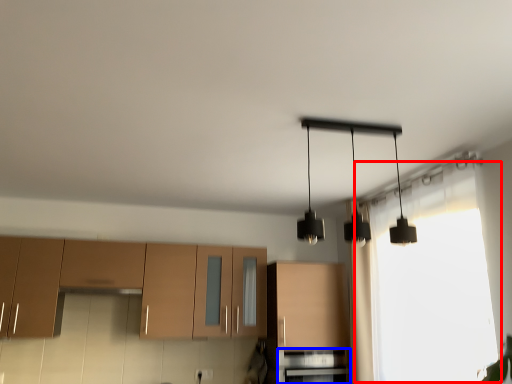
Question: Which point is closer to the camera, window (highlighted by a red box) or oven (highlighted by a blue box)?

Choices:
 (A) window
 (B) oven

Answer: (A)